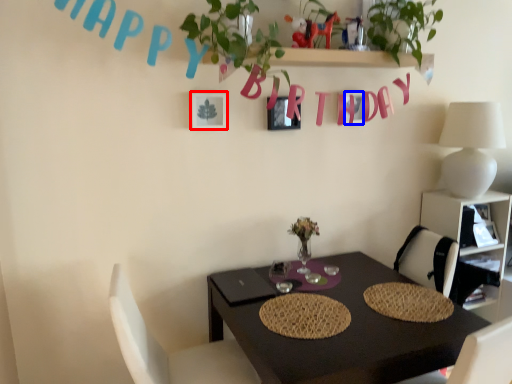
Question: Which of the following is the farthest to the observer, picture frame (highlighted by a red box) or alphabet (highlighted by a blue box)?

Choices:
 (A) picture frame
 (B) alphabet

Answer: (B)